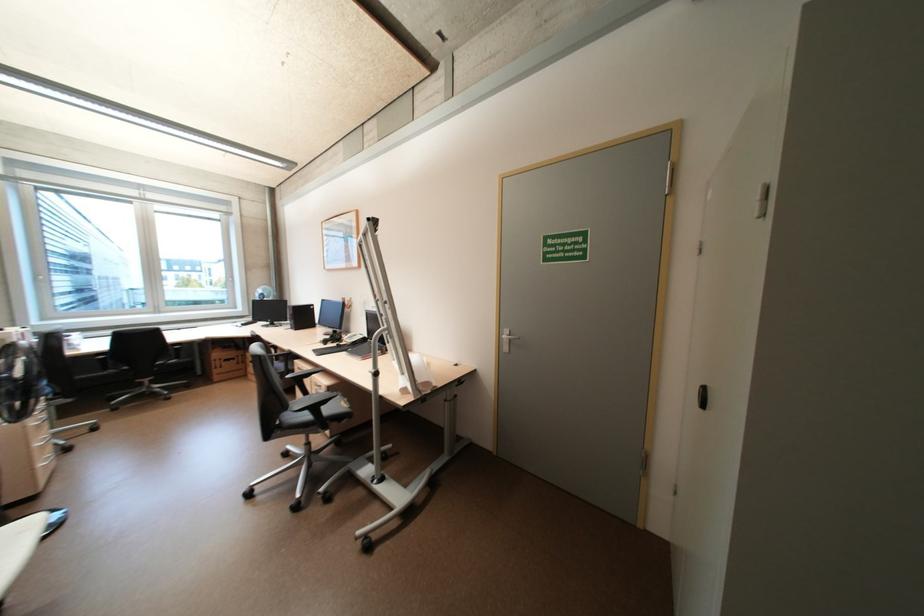
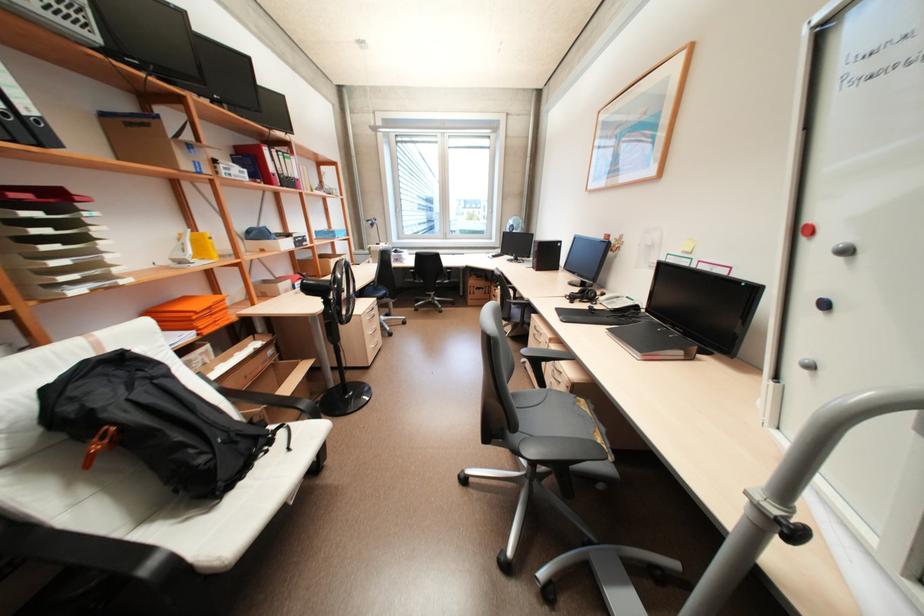
Where in the second image is the point corresponding to (x=305, y=379) from the first image?

(542, 362)